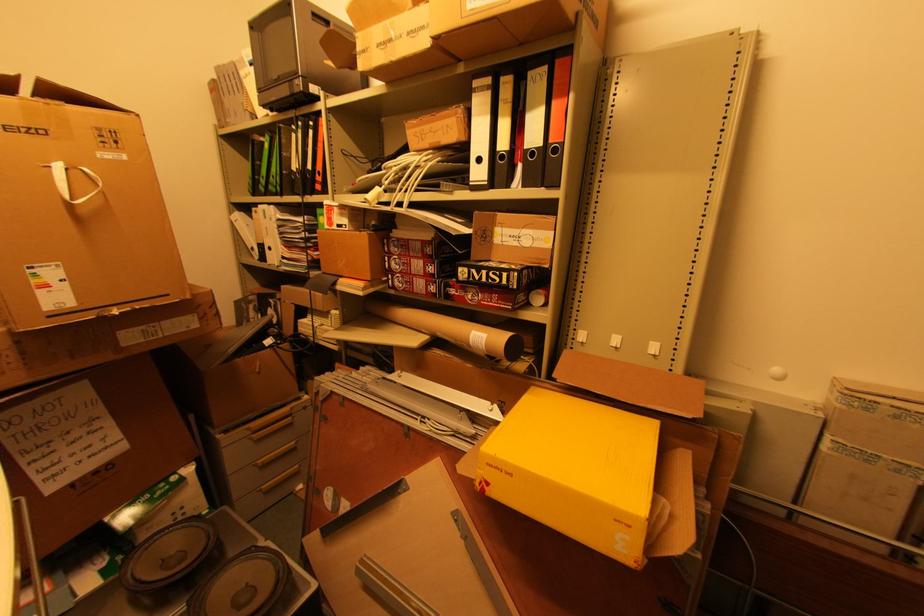
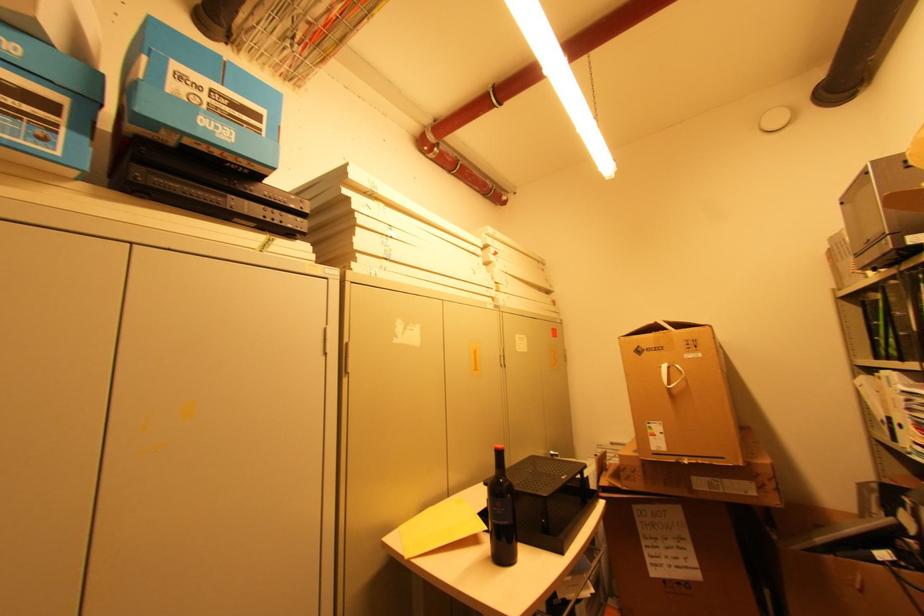
Locate, in the second image, the point that corresponds to [262,180] in the first image.

(881, 341)